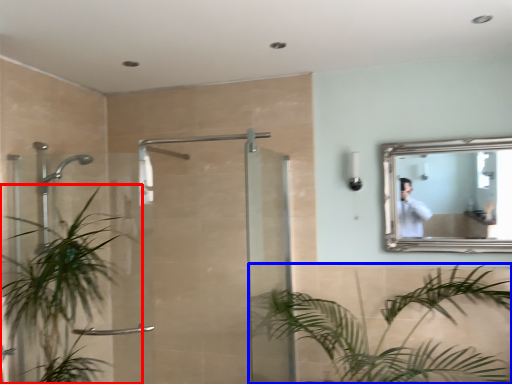
Question: Among these objects, which one is nearest to the camera, houseplant (highlighted by a red box) or houseplant (highlighted by a blue box)?

Choices:
 (A) houseplant
 (B) houseplant

Answer: (B)